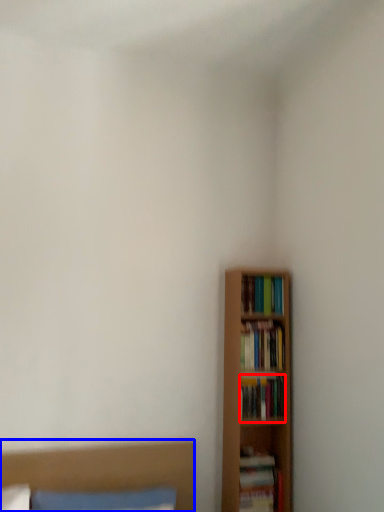
Question: Among these objects, which one is nearest to the camera, book (highlighted by a red box) or bed (highlighted by a blue box)?

Choices:
 (A) book
 (B) bed

Answer: (B)